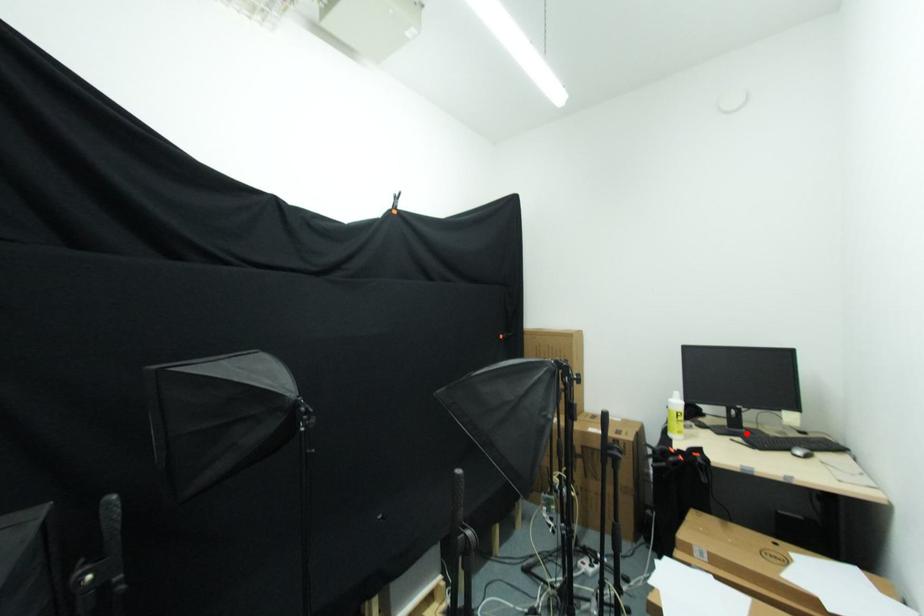
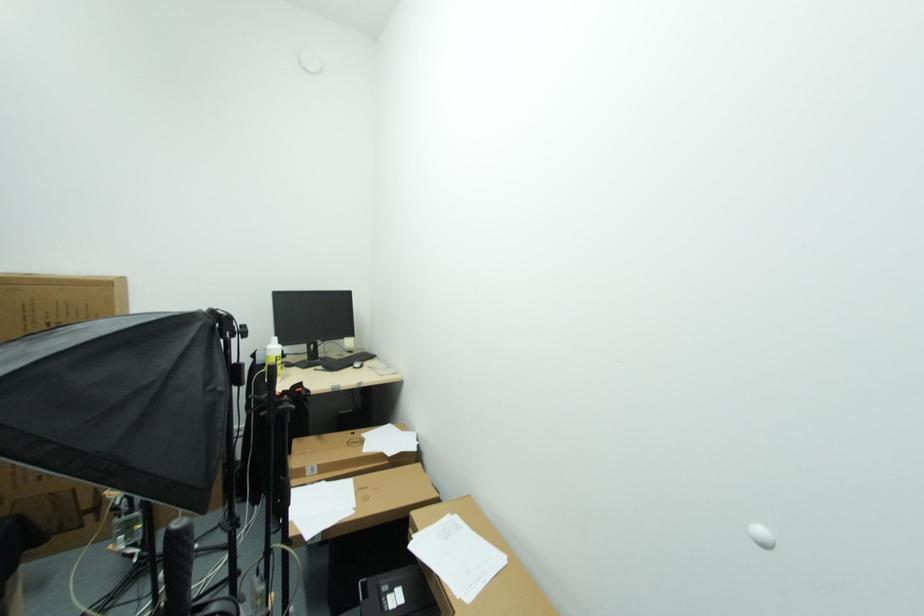
Where in the second image is the point corresponding to the highlighted location from the first image?

(322, 363)